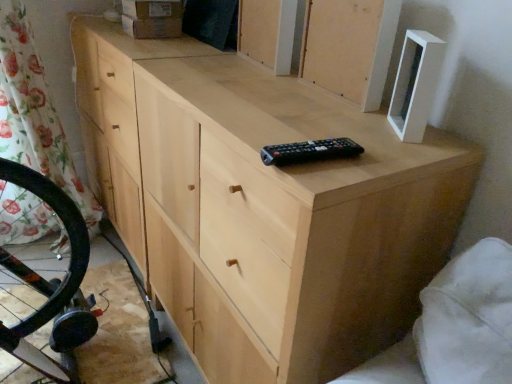
You are a GUI agent. You are given a task and a screenshot of the screen. Output one action in this format:
    pyautogui.click(x=<x>, y=<y>)
    Task: Click on the free spot to the right of black plastic remote control at center
    The width and height of the screenshot is (512, 384).
    Given the screenshot: What is the action you would take?
    pyautogui.click(x=385, y=149)